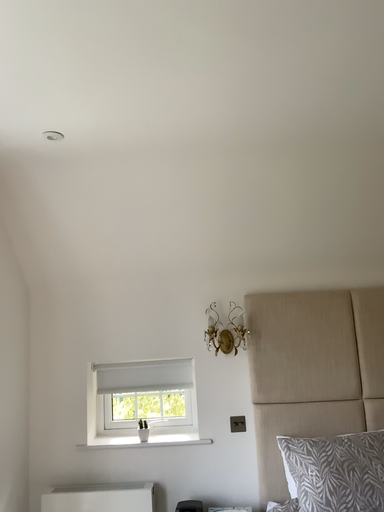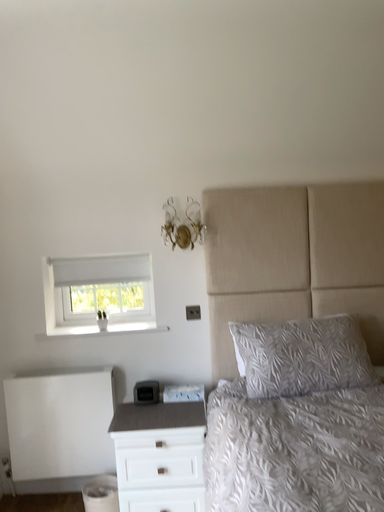
Question: Which way did the camera rotate in the video?

Choices:
 (A) rotated downward
 (B) rotated upward

Answer: (A)